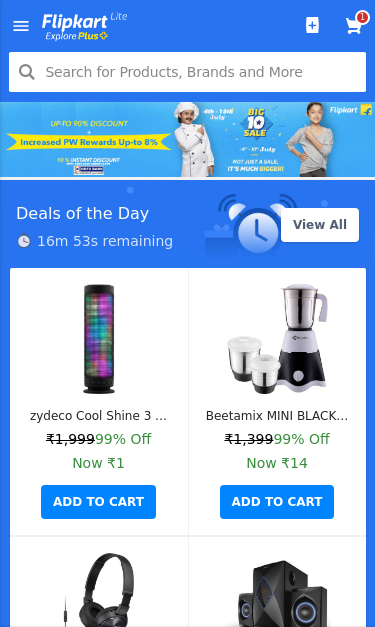
Locate an element on the screen. The width and height of the screenshot is (375, 627). blender is located at coordinates (305, 339).